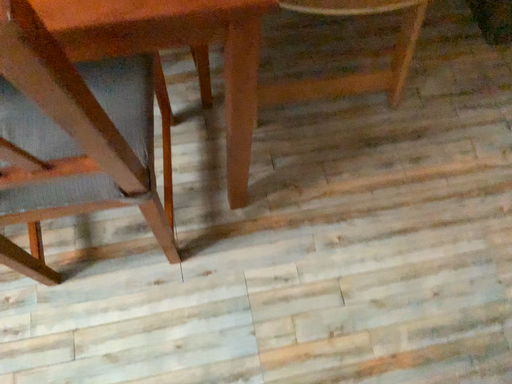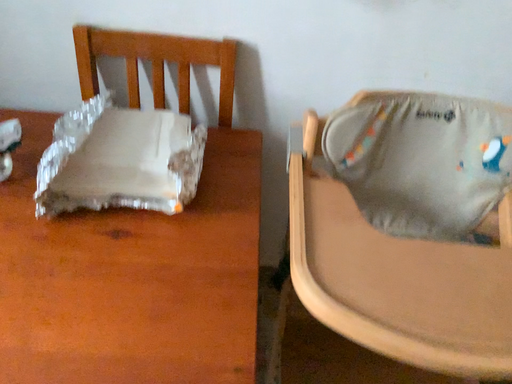
Question: How did the camera likely rotate when shooting the video?

Choices:
 (A) rotated downward
 (B) rotated upward

Answer: (B)